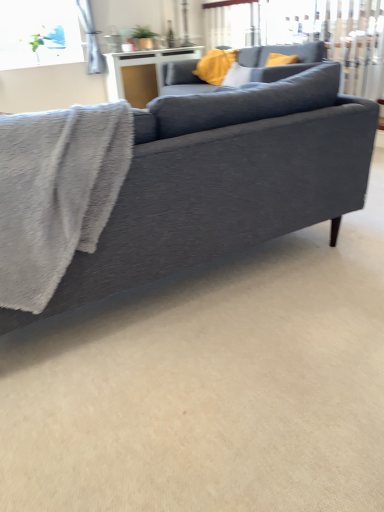
Question: From a real-world perspective, is matte gray couch at upper center, which ranks as the 2th studio couch in front-to-back order, positioned under yellow fabric pillow at upper center based on gravity?

Choices:
 (A) yes
 (B) no

Answer: (A)

Question: From the image's perspective, is matte gray couch at upper center, the 1th studio couch viewed from the back, above yellow fabric pillow at upper center?

Choices:
 (A) no
 (B) yes

Answer: (A)

Question: Is matte gray couch at upper center, the 1th studio couch viewed from the back, bigger than yellow fabric pillow at upper center?

Choices:
 (A) no
 (B) yes

Answer: (B)

Question: Is matte gray couch at upper center, the 1th studio couch viewed from the back, touching yellow fabric pillow at upper center?

Choices:
 (A) yes
 (B) no

Answer: (B)

Question: Is matte gray couch at upper center, the 1th studio couch viewed from the back, aimed at yellow fabric pillow at upper center?

Choices:
 (A) no
 (B) yes

Answer: (B)

Question: From the image's perspective, is matte gray couch at upper center, the 1th studio couch viewed from the back, located beneath yellow fabric pillow at upper center?

Choices:
 (A) no
 (B) yes

Answer: (B)

Question: From a real-world perspective, does yellow fabric pillow at upper center stand above matte gray couch at center, which is counted as the second studio couch, starting from the back?

Choices:
 (A) no
 (B) yes

Answer: (B)

Question: Does yellow fabric pillow at upper center turn towards matte gray couch at center, which ranks as the 1th studio couch in bottom-to-top order?

Choices:
 (A) no
 (B) yes

Answer: (A)

Question: Considering the relative positions of yellow fabric pillow at upper center and matte gray couch at center, which ranks as the 1th studio couch in bottom-to-top order, in the image provided, is yellow fabric pillow at upper center in front of matte gray couch at center, which ranks as the 1th studio couch in bottom-to-top order,?

Choices:
 (A) yes
 (B) no

Answer: (B)

Question: Are yellow fabric pillow at upper center and matte gray couch at center, which is counted as the second studio couch, starting from the back, far apart?

Choices:
 (A) yes
 (B) no

Answer: (A)

Question: Can you confirm if yellow fabric pillow at upper center is wider than matte gray couch at center, arranged as the second studio couch when viewed from the top?

Choices:
 (A) yes
 (B) no

Answer: (B)

Question: From a real-world perspective, is yellow fabric pillow at upper center beneath matte gray couch at center, which is counted as the second studio couch, starting from the back?

Choices:
 (A) no
 (B) yes

Answer: (A)

Question: Is there a large distance between yellow fabric pillow at upper center and white glossy table at upper center?

Choices:
 (A) yes
 (B) no

Answer: (B)